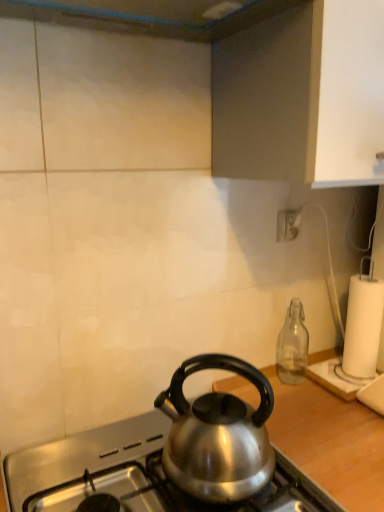
You are a GUI agent. You are given a task and a screenshot of the screen. Output one action in this format:
    pyautogui.click(x=<x>, y=<y>)
    Task: Click on the vacant space situated on the left part of transparent glass bottle at right
    This screenshot has width=384, height=512.
    Given the screenshot: What is the action you would take?
    pyautogui.click(x=254, y=389)